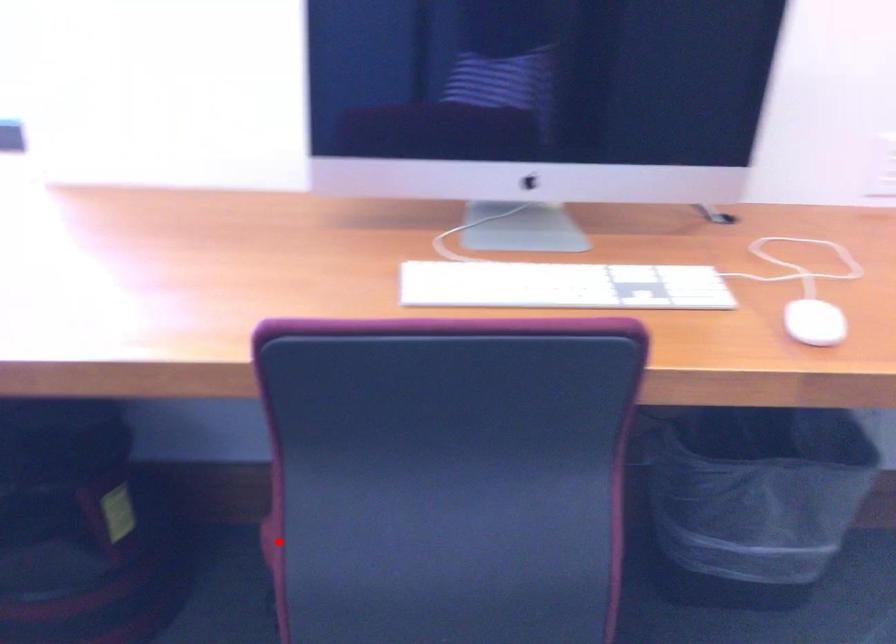
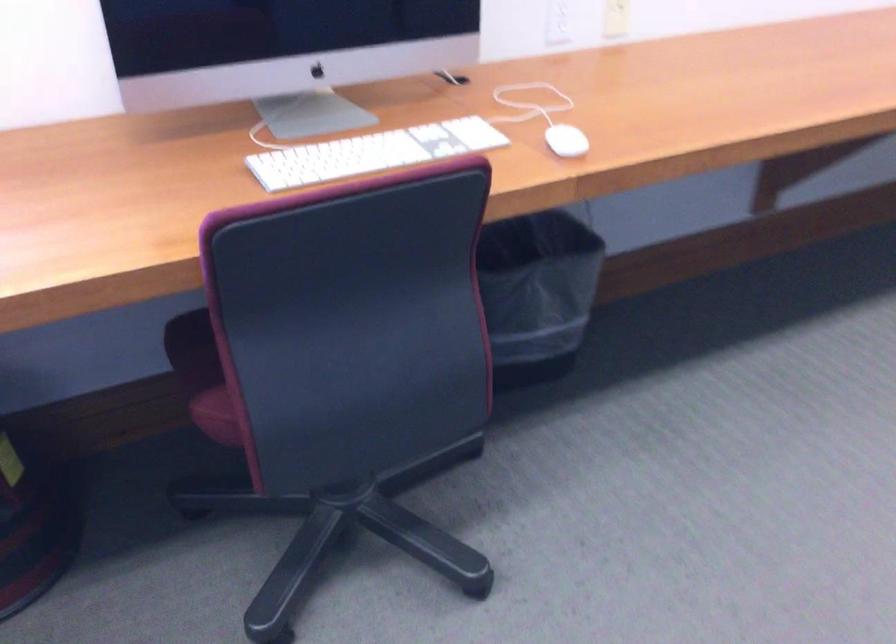
In the second image, find the point that corresponds to the highlighted location in the first image.

(220, 413)